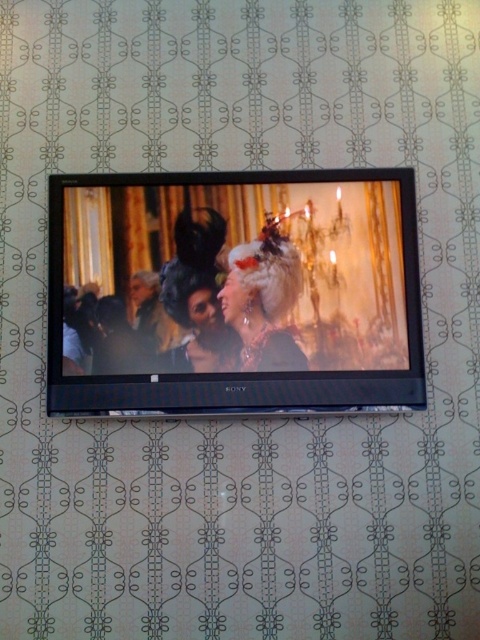
You are standing in a living room and want to hang a picture frame that is 1 meter wide. The black glossy flat screen tv at center is located at coordinates point 0.458, 0.487. If the wall is 3 meters wide, will the picture frame fit to the right of the TV without overlapping?

The black glossy flat screen tv at center is located at point (x=233, y=292). Since the wall is 3 meters wide, the remaining space to the right of the TV would be 3 meters multiplied by the distance from the TV to the edge. However, without knowing the exact position of the TV on the wall, it is impossible to determine if the picture frame will fit without overlapping. Please provide more information about the TV position.

You are standing in front of the Sony television and want to place a small sticker on the screen. You have two options for placement based on coordinates given as points. The points are point (249, 220) and point (276, 349). Which point is closer to you when looking at the TV screen?

Point (249, 220) is closer to you because it is further to the viewer than point (276, 349).

You are standing in front of a wall with a flat screen TV. There is a point marked at coordinates (233, 292). Can you tell me what object this point is located on?

The point (233, 292) is located on the black glossy flat screen tv at center.